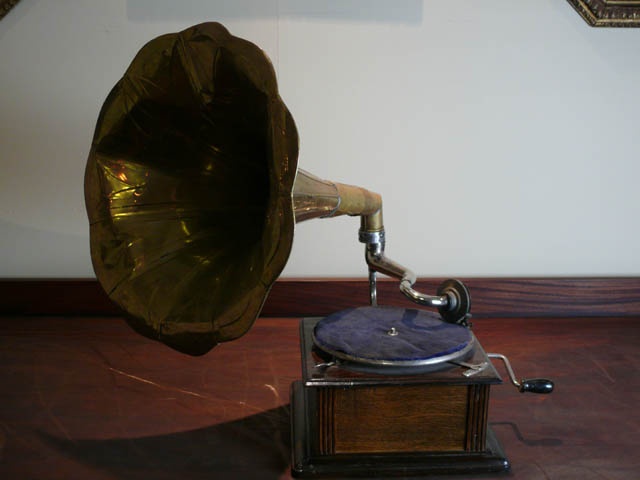
What are the coordinates of `shadow on wall` in the screenshot? It's located at (164, 10), (396, 6).